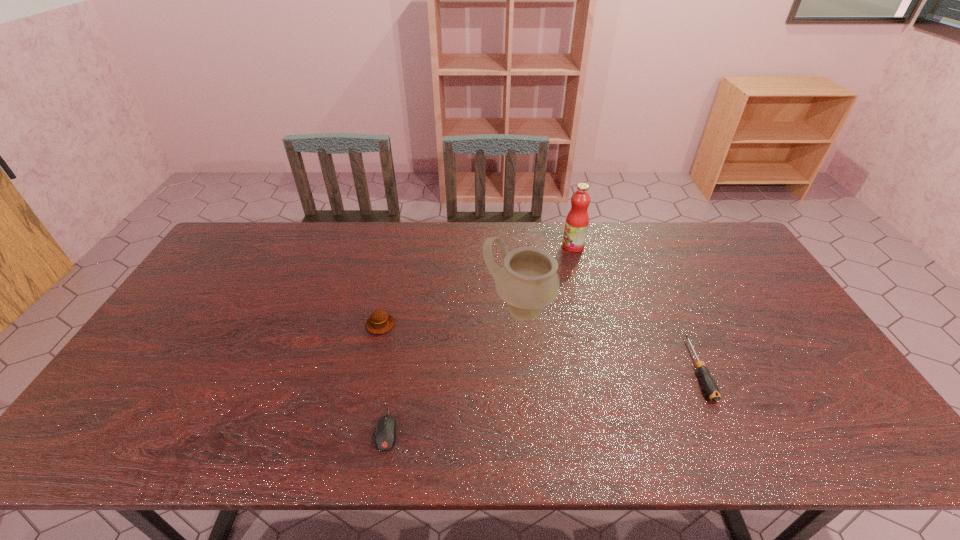
Locate an element on the screen. The width and height of the screenshot is (960, 540). vacant region located 0.390m on the front label of the fourth object from left to right is located at coordinates (451, 246).

This screenshot has width=960, height=540. In order to click on free location located on the front label of the fourth object from left to right in this screenshot , I will do `click(471, 246)`.

I want to click on vacant region located 0.310m on the front of the pottery, so click(531, 432).

Where is `vacant space located 0.290m on the back of the third tallest object`? Image resolution: width=960 pixels, height=540 pixels. vacant space located 0.290m on the back of the third tallest object is located at coordinates (396, 254).

The height and width of the screenshot is (540, 960). I want to click on vacant space located 0.340m on the back of the rightmost object, so click(649, 262).

The height and width of the screenshot is (540, 960). I want to click on vacant space located 0.090m on the back of the computer mouse, so click(396, 378).

Where is `object that is at the far edge`? This screenshot has width=960, height=540. object that is at the far edge is located at coordinates (576, 225).

Identify the location of object that is at the near edge. (385, 437).

The width and height of the screenshot is (960, 540). What are the coordinates of `vacant space at the far edge` in the screenshot? It's located at tap(383, 230).

Image resolution: width=960 pixels, height=540 pixels. Identify the location of vacant space at the left edge of the desktop. (153, 348).